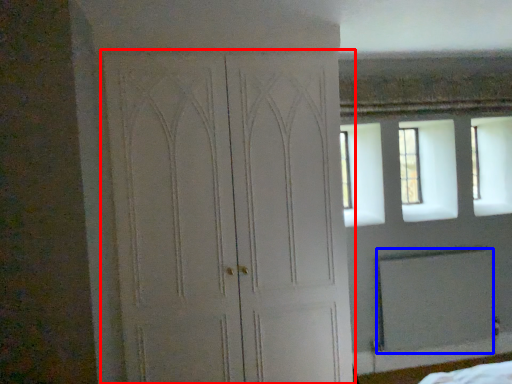
Question: Which object appears farthest to the camera in this image, door (highlighted by a red box) or screen door (highlighted by a blue box)?

Choices:
 (A) door
 (B) screen door

Answer: (B)